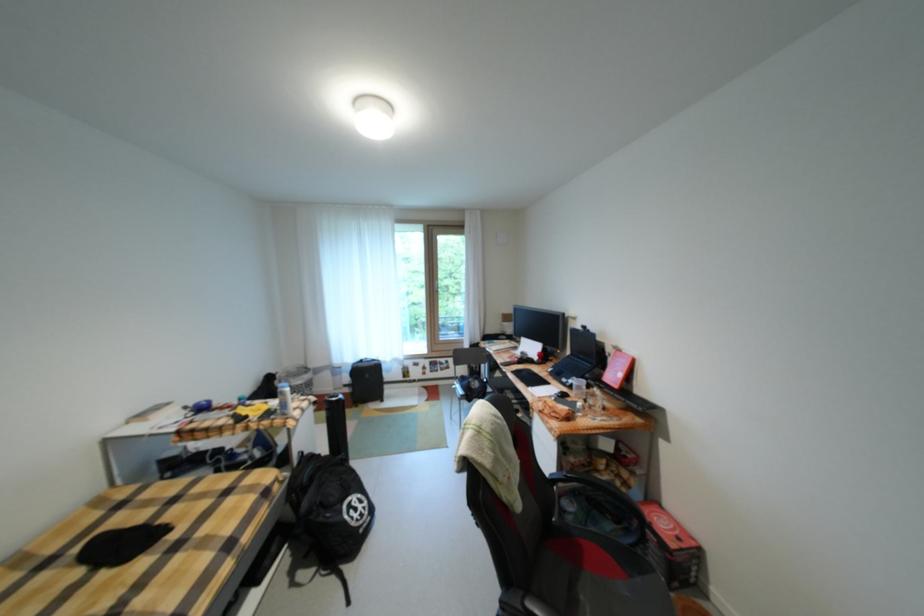
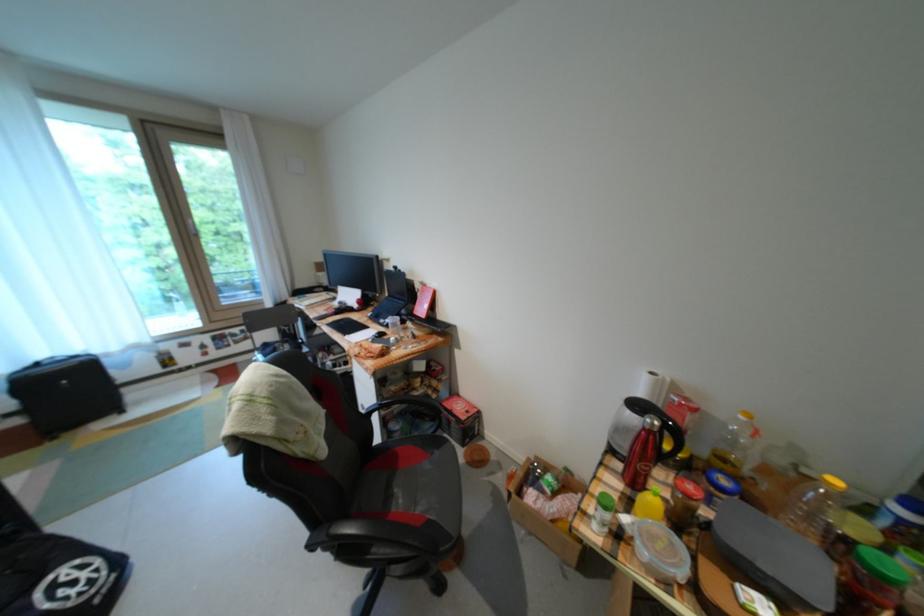
Find the pixel in the second image that matches pixel 572 477 in the first image.

(387, 407)